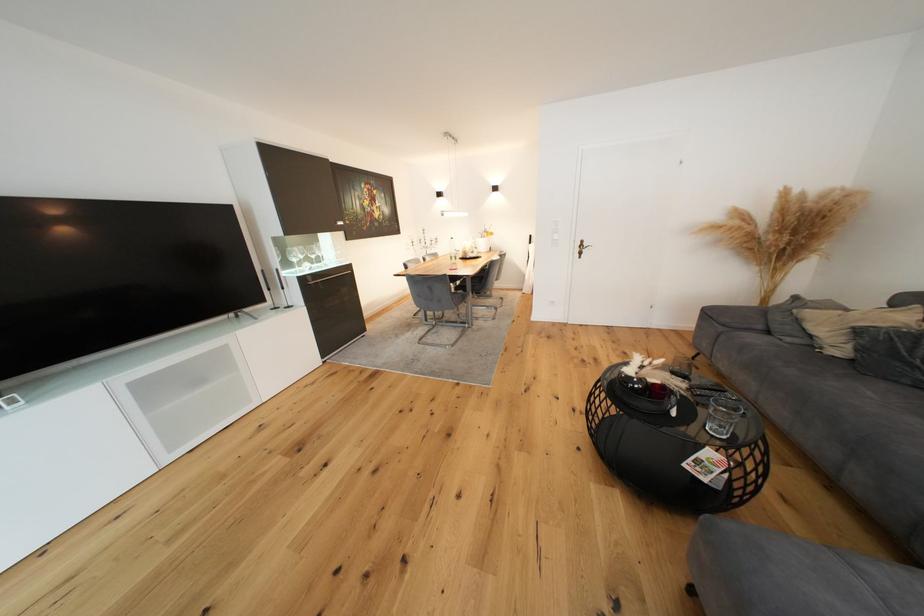
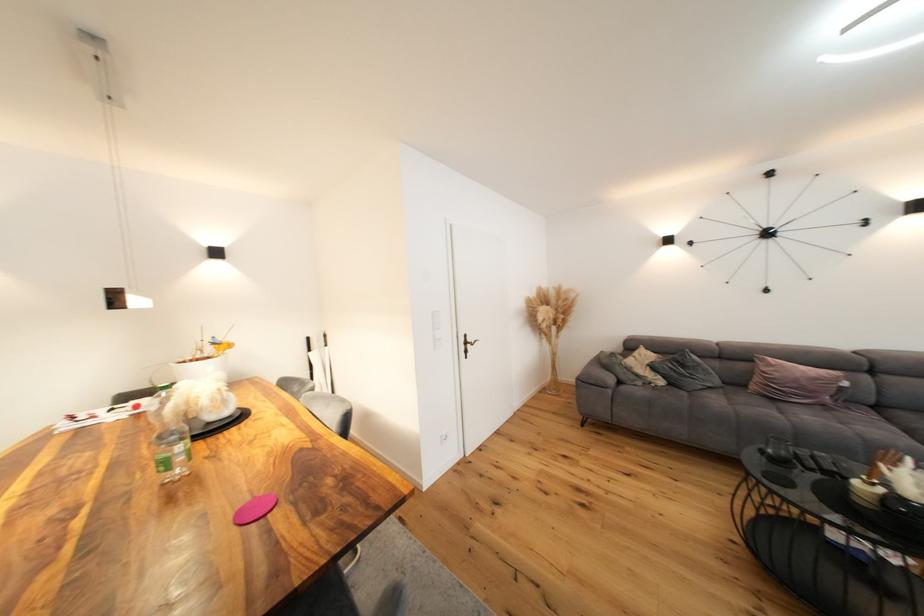
Locate, in the second image, the point that corresponds to point 770,273 in the first image.

(548, 342)